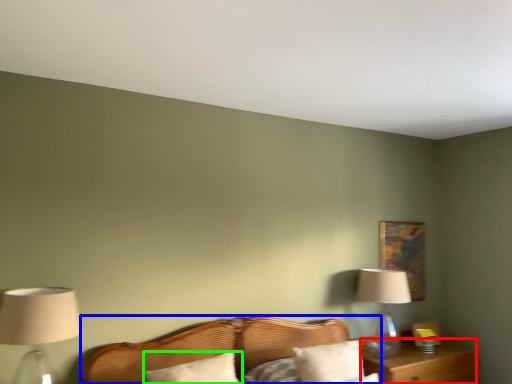
Question: Which object is positioned farthest from nightstand (highlighted by a red box)? Select from bed (highlighted by a blue box) and pillow (highlighted by a green box).

Choices:
 (A) bed
 (B) pillow

Answer: (B)